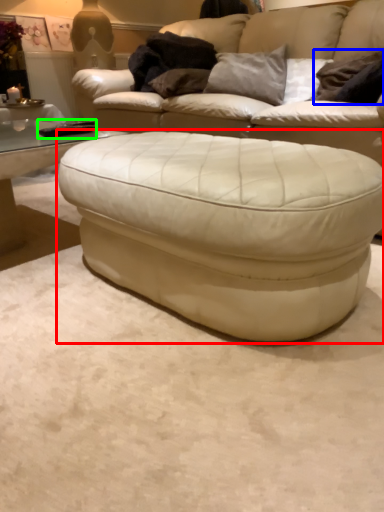
Question: Which is farther away from table (highlighted by a red box)? pillow (highlighted by a blue box) or pad (highlighted by a green box)?

Choices:
 (A) pillow
 (B) pad

Answer: (A)